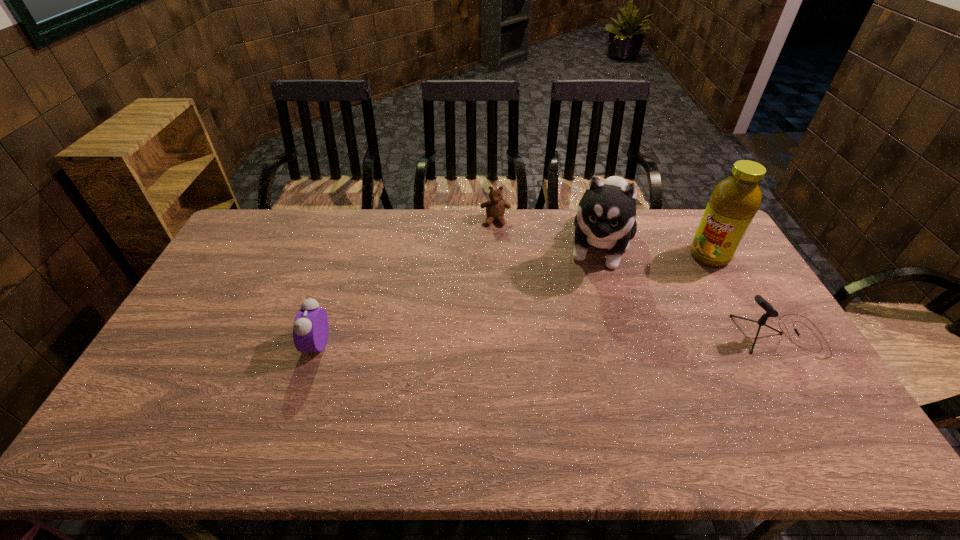
Identify the location of vacant space on the desktop that is between the alarm clock and the microphone and is positioned at the face of the third object from left to right. (570, 339).

You are a GUI agent. You are given a task and a screenshot of the screen. Output one action in this format:
    pyautogui.click(x=<x>, y=<y>)
    Task: Click on the free spot on the desktop that is between the leftmost object and the microphone and is positioned on the front label of the fruit juice
    
    Given the screenshot: What is the action you would take?
    pyautogui.click(x=608, y=339)

At what (x,y) coordinates should I click in order to perform the action: click on vacant space on the desktop that is between the leftmost object and the microphone and is positioned on the front-facing side of the second object from left to right. Please return your answer as a coordinate pair (x, y). This screenshot has height=540, width=960. Looking at the image, I should click on (492, 340).